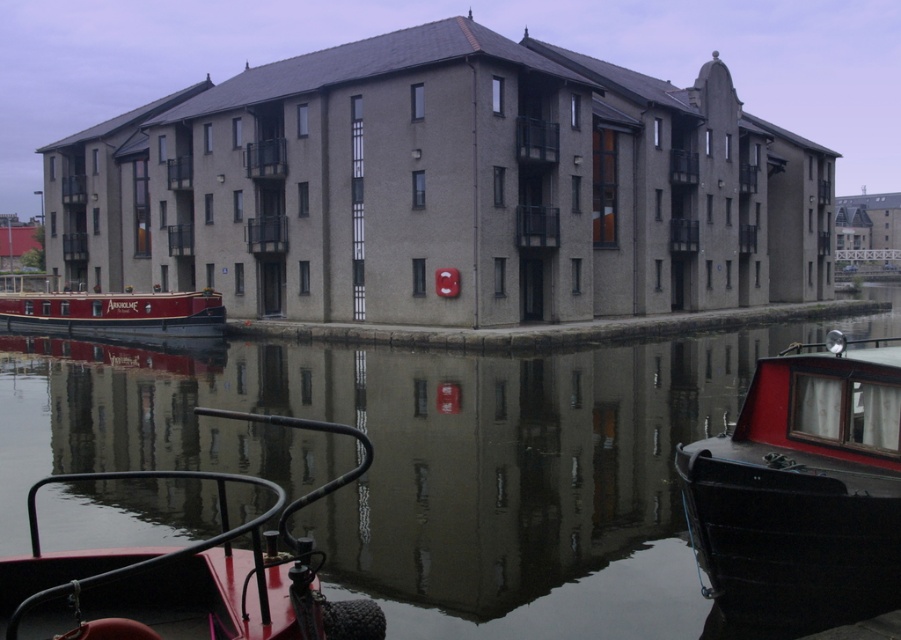
Based on the photo, you are standing on the dock and want to board the metallic red boat at lower left. The smooth concrete canal at center is between you and the boat. Since the canal is taller than the boat, can you still see the boat from your current position?

The smooth concrete canal at center is taller than the metallic red boat at lower left, so the canal might block your view of the boat if it is positioned between you and the boat. However, since the canal is at the center and the boat is at the lower left, you might still see the boat around the canal depending on the exact positioning.

You are a tourist standing on the canal bank and want to take a photo of both the metallic red boat at lower left and the matte red boat at left. Which boat should you look down at to capture both in your shot?

You should look down at the metallic red boat at lower left because it is located below the matte red boat at left, so positioning yourself above the metallic red boat at lower left would allow you to see both boats in your view.

You are a delivery person who needs to navigate a narrowboat through the canal. The boat you are on is the red polished wood boat at right. Can you safely pass through the smooth concrete canal at center without touching the sides?

The smooth concrete canal at center might be wider than the red polished wood boat at right, so there is a possibility that the boat can pass safely without touching the sides. However, the exact width difference is uncertain based on the provided information.